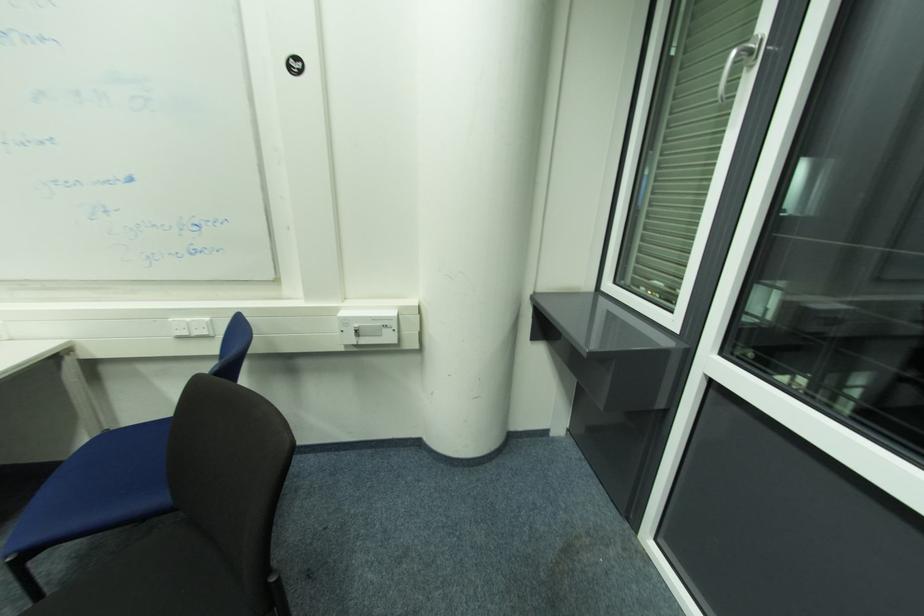
This screenshot has width=924, height=616. Find the location of `blue chair sitting surface`. blue chair sitting surface is located at coordinates (119, 475).